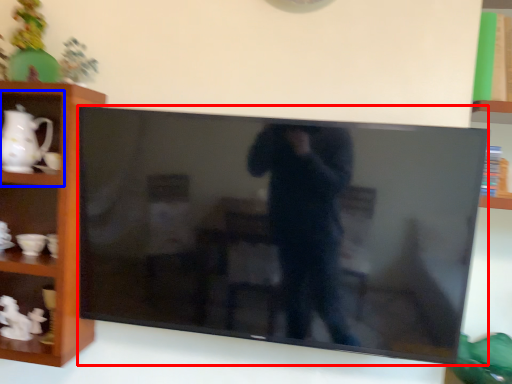
Question: Which object appears farthest to the camera in this image, television (highlighted by a red box) or cabinet (highlighted by a blue box)?

Choices:
 (A) television
 (B) cabinet

Answer: (B)